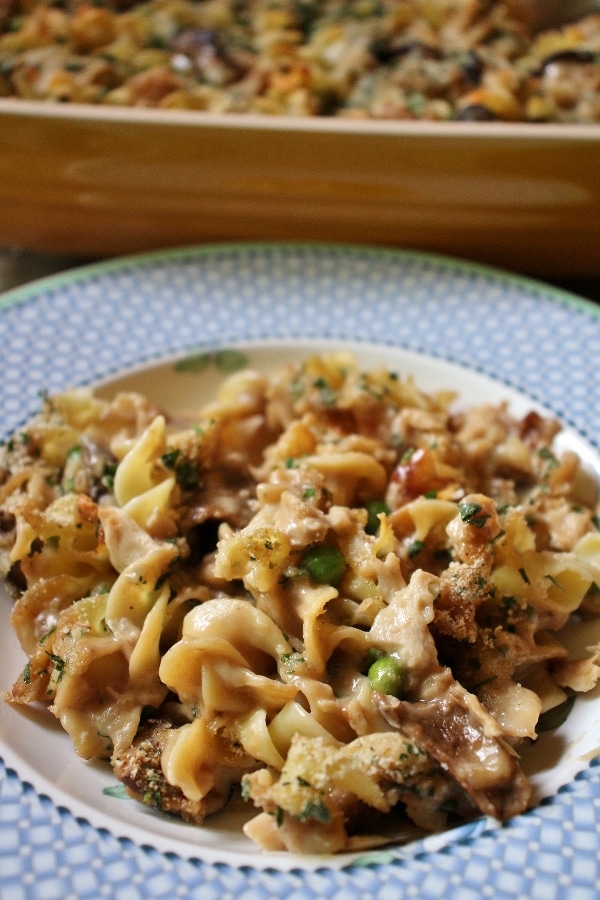
Where is `bowl section of plate`? The height and width of the screenshot is (900, 600). bowl section of plate is located at coordinates (56, 760).